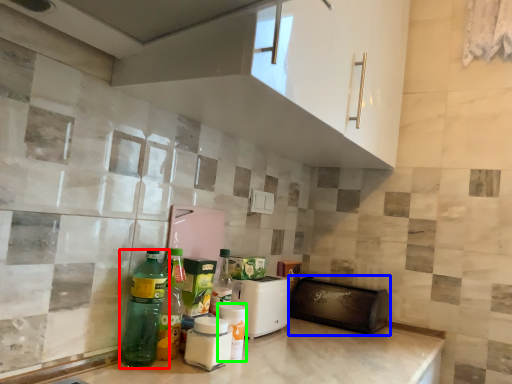
Question: Estimate the real-world distances between objects in this image. Which object is closer to bottle (highlighted by a red box), appliance (highlighted by a blue box) or bottle (highlighted by a green box)?

Choices:
 (A) appliance
 (B) bottle

Answer: (B)